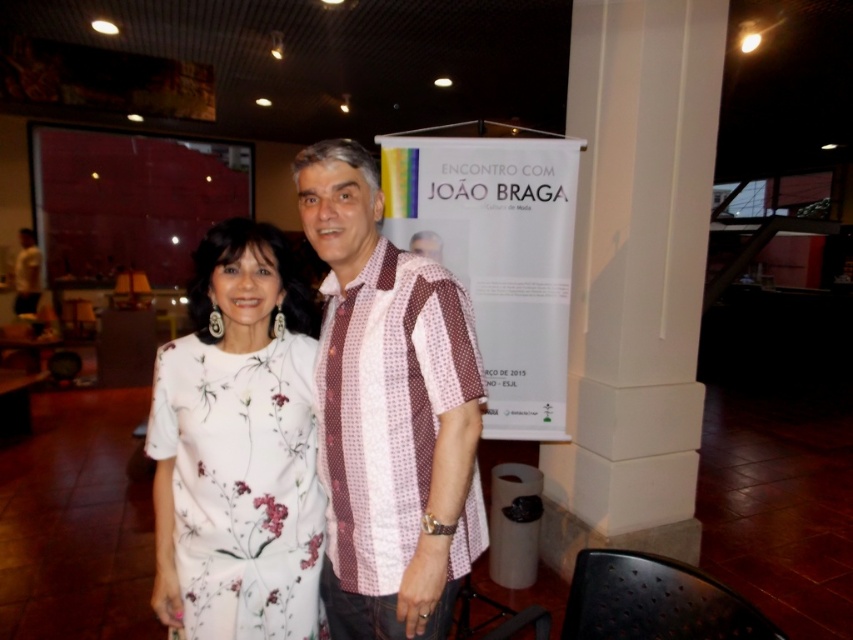
You are a photographer setting up for a group photo. You need to ensure that all subjects fit within the camera frame. Given that the patterned fabric shirt at center and white floral dress at center are the main focal points, which one might require more space horizontally to accommodate its width?

The patterned fabric shirt at center might be wider than the white floral dress at center, so it might require more horizontal space to accommodate its width.

You are a photographer setting up for a photoshoot. You need to ensure that the white floral dress at center is visible in the frame without being blocked by the white smooth pillar at center. Based on their widths, which object should you position closer to the camera to achieve this?

The white smooth pillar at center is wider than the white floral dress at center. To ensure the dress remains visible, position the white smooth pillar at center farther from the camera so its larger width doesn not block the dress.

You are a photographer setting up for a photoshoot. You need to ensure that the white smooth pillar at center and the white floral dress at center are both visible in the frame. Based on their positions, which object is closer to the camera?

The white smooth pillar at center is positioned over the white floral dress at center, meaning it is closer to the camera.